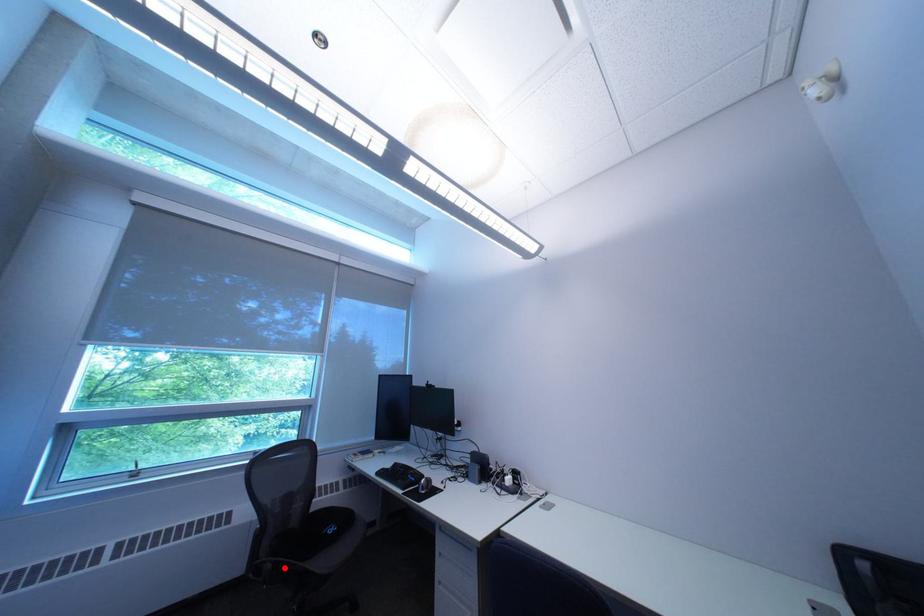
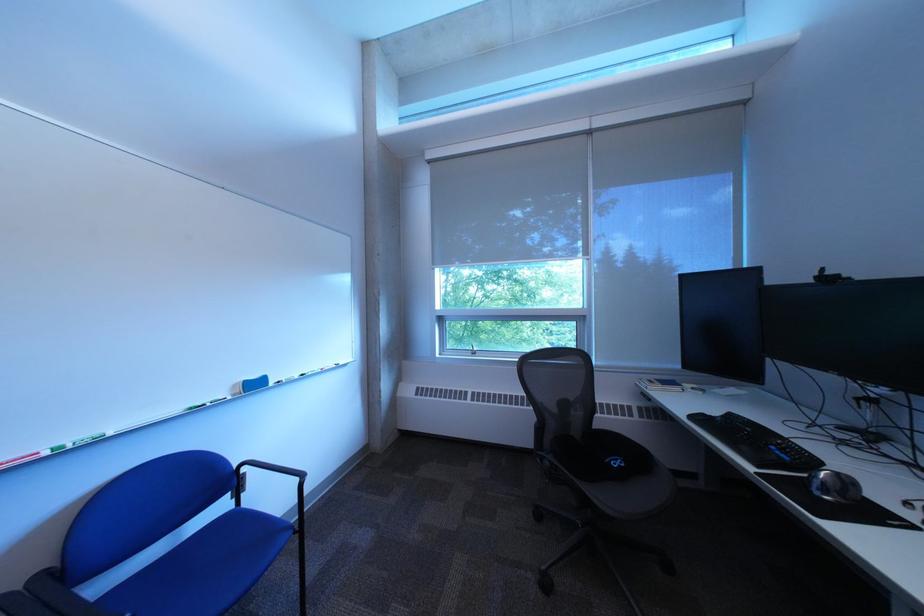
The point at the highlighted location is marked in the first image. Where is the corresponding point in the second image?

(563, 464)